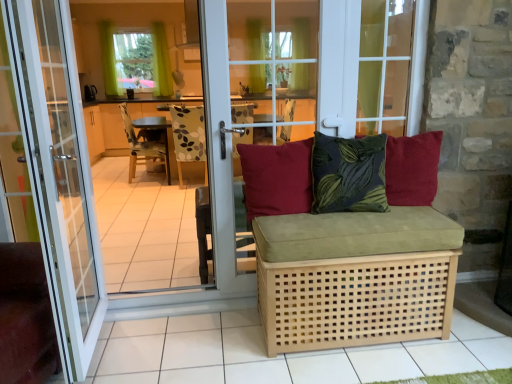
Question: Does point (111, 332) appear closer or farther from the camera than point (97, 294)?

Choices:
 (A) closer
 (B) farther

Answer: (A)

Question: Is natural wood tile at lower center taller or shorter than white glass door at center?

Choices:
 (A) short
 (B) tall

Answer: (A)

Question: Based on their relative distances, which object is farther from the transparent glass door at center?

Choices:
 (A) white glass door at center
 (B) patterned fabric chair at center
 (C) dark green velvet cushion at center, the second pillow when ordered from left to right
 (D) light brown woven studio couch at center
 (E) matte red cushion at center, the 1th pillow viewed from the left

Answer: (B)

Question: Which of these objects is positioned farthest from the patterned fabric chair at center?

Choices:
 (A) red cotton cushion at center, the first pillow when ordered from right to left
 (B) green fabric curtain at upper center, which is the 1th curtain from right to left
 (C) white glass door at center
 (D) green fabric curtain at upper left, the 2th window in the bottom-to-top sequence
 (E) matte red cushion at center, marked as the 3th pillow in a right-to-left arrangement

Answer: (A)